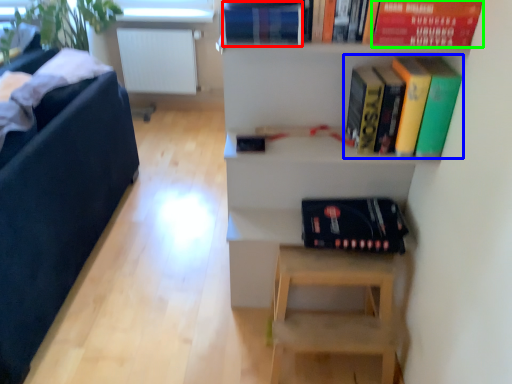
Question: Which object is the farthest from paperback book (highlighted by a red box)? Choose among these: book (highlighted by a blue box) or paperback book (highlighted by a green box).

Choices:
 (A) book
 (B) paperback book

Answer: (A)